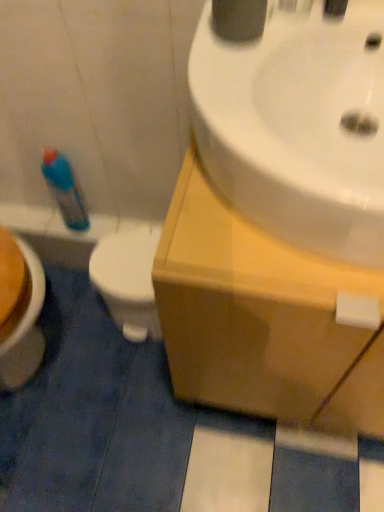
Find the location of a particular element. blank space above white glossy toilet at lower left (from a real-world perspective) is located at coordinates [125, 258].